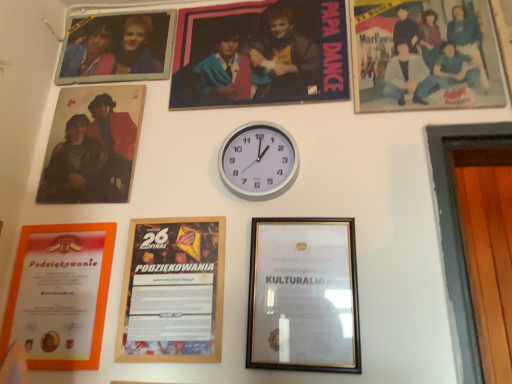
Question: From a real-world perspective, is orange paper certificate at lower left, which appears as the first picture frame when viewed from the left, located beneath metallic photo frame at upper left, the fifth picture frame in the right-to-left sequence?

Choices:
 (A) no
 (B) yes

Answer: (B)

Question: From the image's perspective, is orange paper certificate at lower left, which appears as the first picture frame when viewed from the left, over metallic photo frame at upper left, placed as the third picture frame when sorted from left to right?

Choices:
 (A) yes
 (B) no

Answer: (B)

Question: Is the position of orange paper certificate at lower left, arranged as the 7th picture frame when viewed from the right, more distant than that of metallic photo frame at upper left, the fifth picture frame in the right-to-left sequence?

Choices:
 (A) no
 (B) yes

Answer: (A)

Question: Could metallic photo frame at upper left, the fifth picture frame in the right-to-left sequence, be considered to be inside orange paper certificate at lower left, arranged as the 7th picture frame when viewed from the right?

Choices:
 (A) yes
 (B) no

Answer: (B)

Question: Does orange paper certificate at lower left, which appears as the first picture frame when viewed from the left, turn towards metallic photo frame at upper left, the fifth picture frame in the right-to-left sequence?

Choices:
 (A) yes
 (B) no

Answer: (B)

Question: Is metallic photo frame at upper left, placed as the third picture frame when sorted from left to right, spatially inside orange paper certificate at lower left, arranged as the 7th picture frame when viewed from the right, or outside of it?

Choices:
 (A) inside
 (B) outside

Answer: (B)

Question: Is metallic photo frame at upper left, placed as the third picture frame when sorted from left to right, to the left or to the right of orange paper certificate at lower left, arranged as the 7th picture frame when viewed from the right, in the image?

Choices:
 (A) right
 (B) left

Answer: (A)

Question: From a real-world perspective, is metallic photo frame at upper left, the fifth picture frame in the right-to-left sequence, above or below orange paper certificate at lower left, arranged as the 7th picture frame when viewed from the right?

Choices:
 (A) above
 (B) below

Answer: (A)

Question: Considering the positions of metallic photo frame at upper left, the fifth picture frame in the right-to-left sequence, and orange paper certificate at lower left, which appears as the first picture frame when viewed from the left, in the image, is metallic photo frame at upper left, the fifth picture frame in the right-to-left sequence, wider or thinner than orange paper certificate at lower left, which appears as the first picture frame when viewed from the left,?

Choices:
 (A) wide
 (B) thin

Answer: (B)

Question: Considering their positions, is white metallic clock at center located in front of or behind orange paper certificate at lower left, arranged as the 7th picture frame when viewed from the right?

Choices:
 (A) front
 (B) behind

Answer: (B)

Question: Is point (232, 130) closer or farther from the camera than point (32, 319)?

Choices:
 (A) farther
 (B) closer

Answer: (A)

Question: Considering the relative positions of white metallic clock at center and orange paper certificate at lower left, which appears as the first picture frame when viewed from the left, in the image provided, is white metallic clock at center to the left or to the right of orange paper certificate at lower left, which appears as the first picture frame when viewed from the left,?

Choices:
 (A) left
 (B) right

Answer: (B)

Question: Is white metallic clock at center situated inside orange paper certificate at lower left, which appears as the first picture frame when viewed from the left, or outside?

Choices:
 (A) inside
 (B) outside

Answer: (B)

Question: In the image, is matte wooden photo frame at upper left, the 2th picture frame in the left-to-right sequence, on the left side or the right side of orange paper certificate at lower left, which appears as the first picture frame when viewed from the left?

Choices:
 (A) right
 (B) left

Answer: (A)

Question: Considering their positions, is matte wooden photo frame at upper left, the 2th picture frame in the left-to-right sequence, located in front of or behind orange paper certificate at lower left, which appears as the first picture frame when viewed from the left?

Choices:
 (A) behind
 (B) front

Answer: (A)